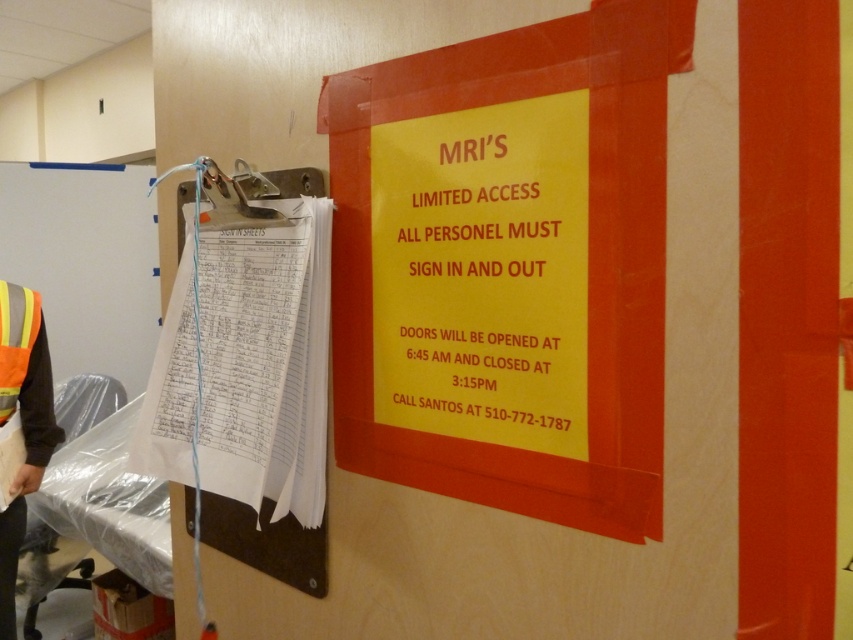
You are a worker in the MRI area and need to locate the point marked at coordinates (483, 273) on the wall. Where would you find this point?

The point marked at coordinates (483, 273) is on the yellow paper sign at upper center.